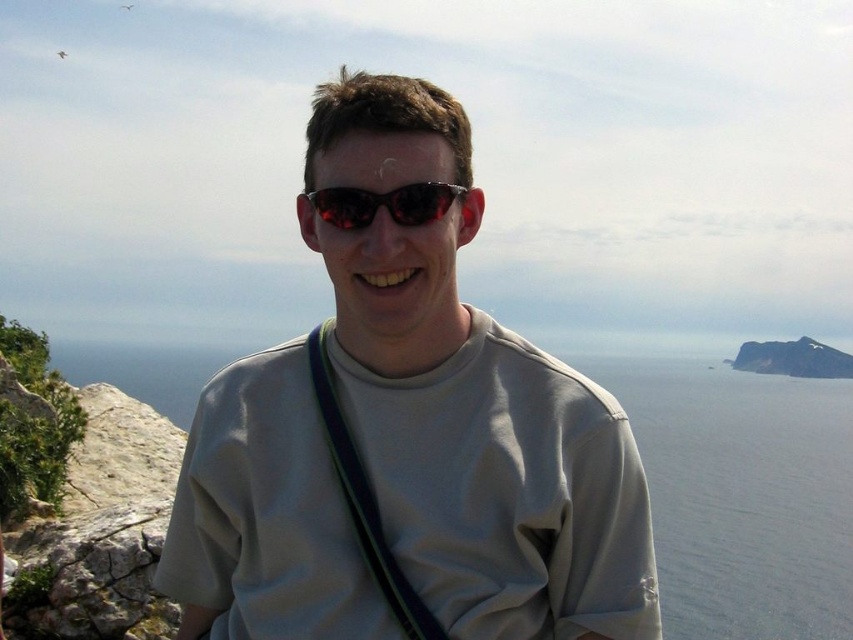
You are a photographer trying to capture the person in the scene. You need to ensure that the gray matte shirt at center and the black fabric strap at center are both clearly visible in your shot. Which object will appear wider in the photo?

The gray matte shirt at center will appear wider in the photo because its width surpasses that of the black fabric strap at center.

You are a photographer trying to capture the landscape in front of you. You notice the gray matte shirt at center and the black fabric strap at center. Which object is closer to the camera lens? Explain your reasoning based on the scene.

The gray matte shirt at center is closer to the camera lens because the black fabric strap at center is positioned behind it, as stated in the object description.